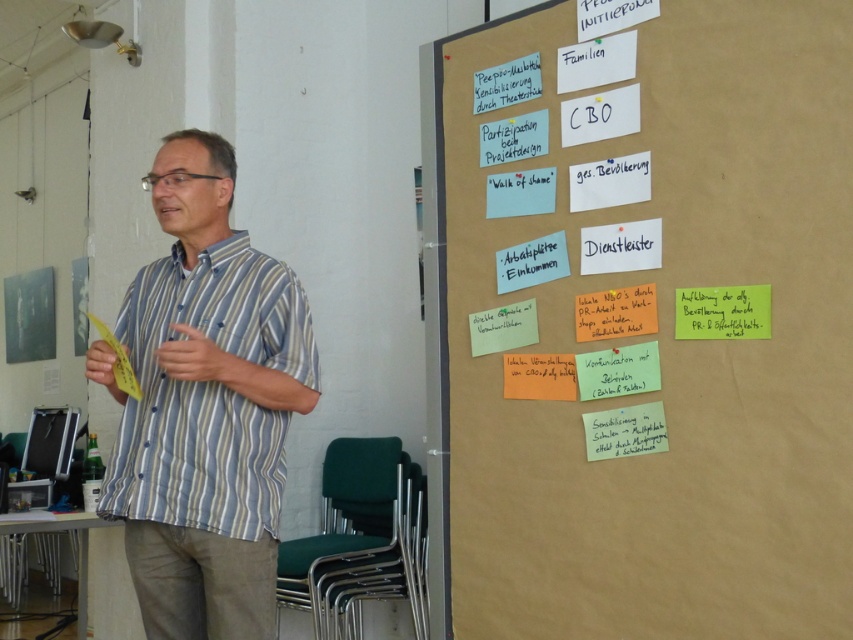
You are an assistant who needs to locate the white paper notes at upper right. Based on the scene, where should you look relative to the striped cotton shirt at center?

The white paper notes at upper right are positioned on the right side of the striped cotton shirt at center.

You need to determine if the white paper notes at upper right can cover the striped cotton shirt at center if placed directly over it. Can they?

The white paper notes at upper right might be wider than striped cotton shirt at center, so they could potentially cover it depending on their exact dimensions and positioning.